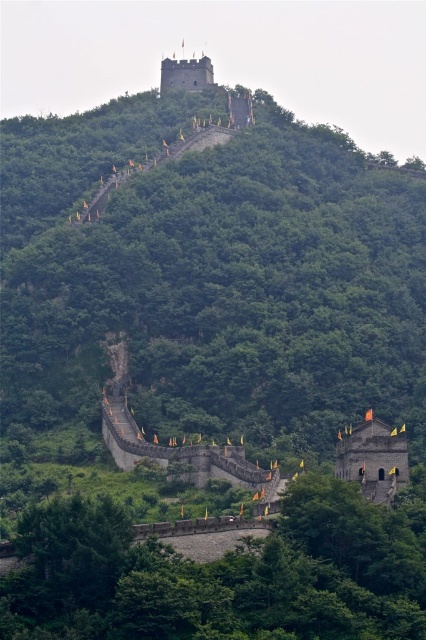
Question: Is stone wall at center further to the viewer compared to rustic stone tower at center?

Choices:
 (A) yes
 (B) no

Answer: (A)

Question: Is rustic stone tower at center positioned at the back of smooth gray stone tower at upper center?

Choices:
 (A) yes
 (B) no

Answer: (B)

Question: Which object is the farthest from the rustic stone tower at center?

Choices:
 (A) smooth gray stone tower at upper center
 (B) stone wall at center

Answer: (A)

Question: Which of the following is the closest to the observer?

Choices:
 (A) (198, 445)
 (B) (215, 86)

Answer: (A)

Question: Which of the following is the closest to the observer?

Choices:
 (A) stone wall at center
 (B) smooth gray stone tower at upper center

Answer: (A)

Question: Can you confirm if stone wall at center is positioned to the right of rustic stone tower at center?

Choices:
 (A) no
 (B) yes

Answer: (A)